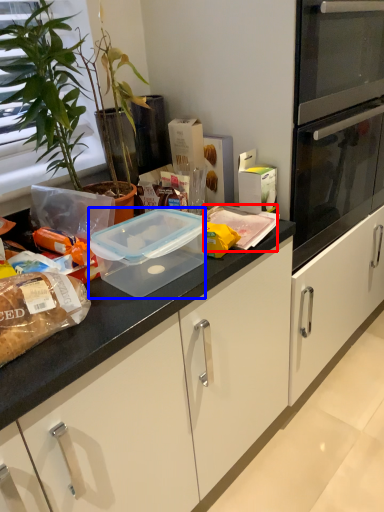
Question: Which object appears closest to the camera in this image, food (highlighted by a red box) or appliance (highlighted by a blue box)?

Choices:
 (A) food
 (B) appliance

Answer: (B)